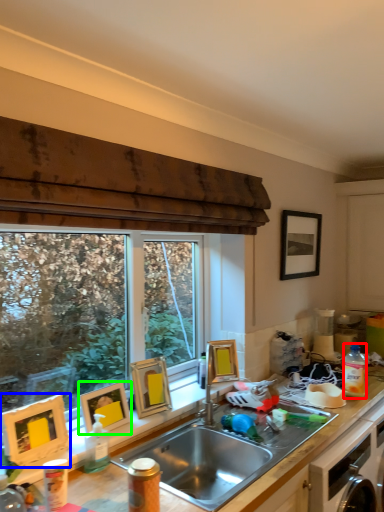
Question: Which object is the farthest from bottle (highlighted by a red box)? Choose among these: picture frame (highlighted by a blue box) or picture frame (highlighted by a green box).

Choices:
 (A) picture frame
 (B) picture frame

Answer: (A)